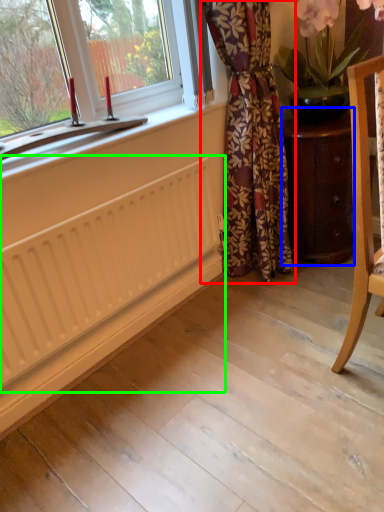
Question: Estimate the real-world distances between objects in this image. Which object is closer to curtain (highlighted by a red box), furniture (highlighted by a blue box) or radiator (highlighted by a green box)?

Choices:
 (A) furniture
 (B) radiator

Answer: (A)